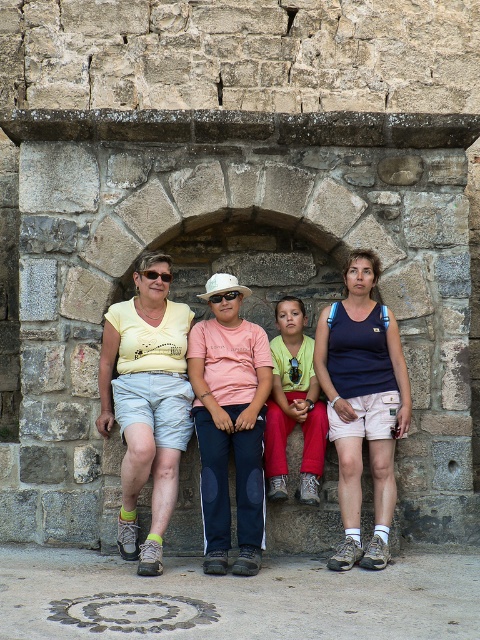
You are standing at point [152,269] and want to walk to point [360,385]. Which direction should you move in?

You should move forward because point [360,385] is in front of point [152,269].

Based on the photo, in the scene, there are two adults and two children sitting against a stone wall. You notice two individuals wearing tops with different colors and materials. The first is a light yellow cotton shirt at center, and the second is a navy blue tank top at center. From the perspective of someone standing in front of the stone wall, which of these two tops is positioned to the left?

The light yellow cotton shirt at center is positioned to the left of the navy blue tank top at center.